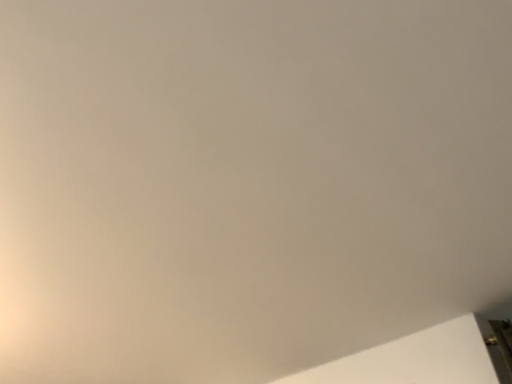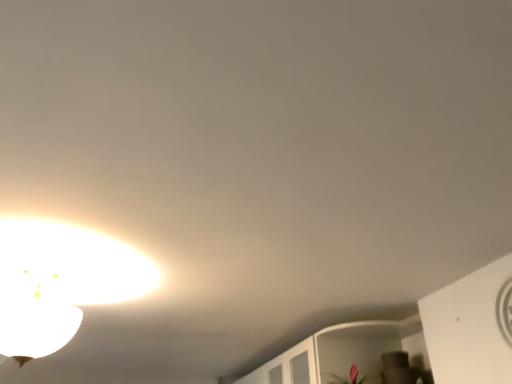
Question: How did the camera likely rotate when shooting the video?

Choices:
 (A) rotated downward
 (B) rotated upward

Answer: (A)